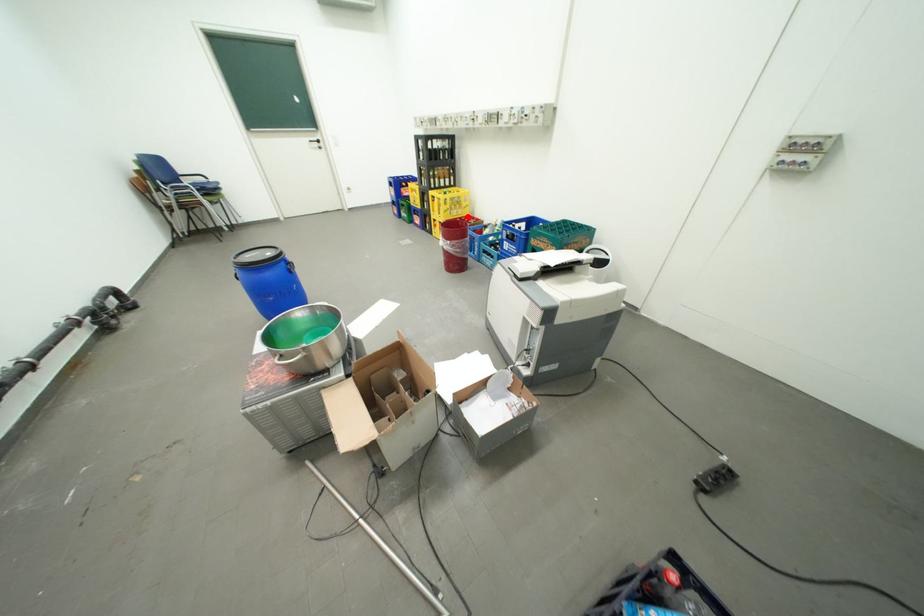
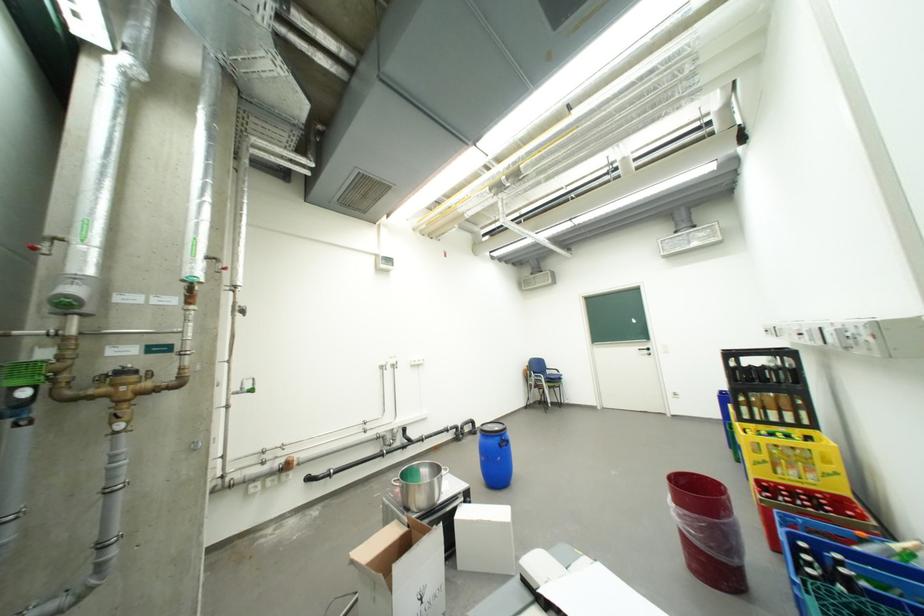
The point at the highlighted location is marked in the first image. Where is the corresponding point in the second image?

(810, 484)